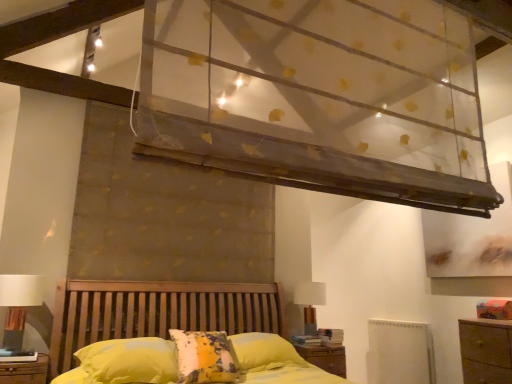
Question: Is yellow fabric pillow at center inside or outside of white fabric lampshade at upper right, marked as the second table lamp in a left-to-right arrangement?

Choices:
 (A) outside
 (B) inside

Answer: (A)

Question: From their relative heights in the image, would you say yellow fabric pillow at center is taller or shorter than white fabric lampshade at upper right, the 2th table lamp from the front?

Choices:
 (A) tall
 (B) short

Answer: (B)

Question: Estimate the real-world distances between objects in this image. Which object is farther from the white matte radiator at lower right?

Choices:
 (A) yellow fabric pillow at center
 (B) white fabric lampshade at upper right, the 2th table lamp from the front
 (C) white fabric lampshade at left, the 1th table lamp from the front
 (D) transparent fabric canopy at upper center
 (E) wooden nightstand at lower center

Answer: (C)

Question: Considering the real-world distances, which object is closest to the white matte radiator at lower right?

Choices:
 (A) yellow fabric pillow at center
 (B) white fabric lampshade at left, which is the first table lamp from left to right
 (C) wooden nightstand at lower center
 (D) white fabric lampshade at upper right, positioned as the first table lamp in back-to-front order
 (E) transparent fabric canopy at upper center

Answer: (C)